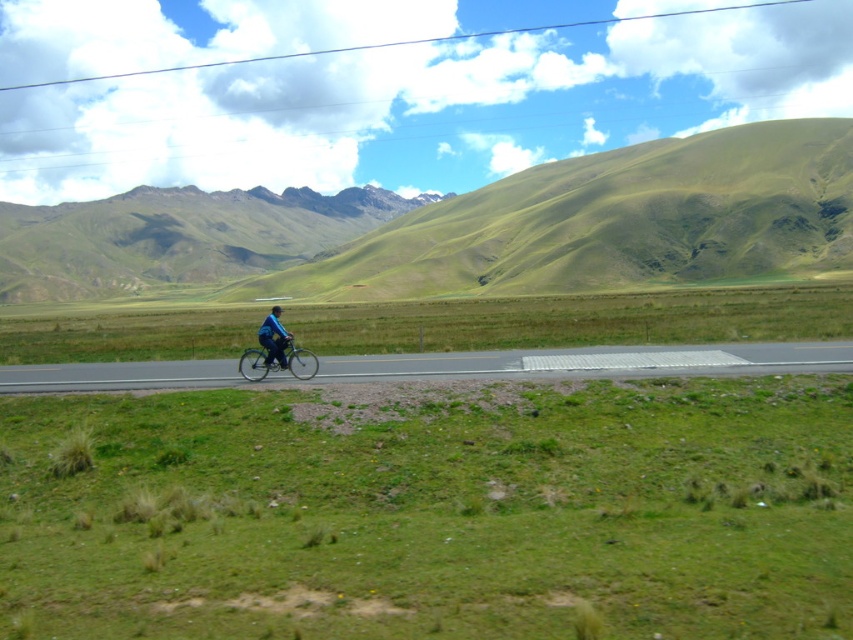
Question: Which object is closer to the camera taking this photo?

Choices:
 (A) black matte helmet at center
 (B) green grassy hill at upper center
 (C) blue matte bicycle at center

Answer: (C)

Question: Which object is positioned closest to the green grassy mountain at upper center?

Choices:
 (A) blue matte bicycle at center
 (B) black matte helmet at center
 (C) blue fabric jacket at center

Answer: (B)

Question: Which of these objects is positioned closest to the blue fabric jacket at center?

Choices:
 (A) blue matte bicycle at center
 (B) green grassy hill at upper center
 (C) black matte helmet at center

Answer: (A)

Question: Does green grassy mountain at upper center have a lesser width compared to blue fabric jacket at center?

Choices:
 (A) no
 (B) yes

Answer: (A)

Question: Observing the image, what is the correct spatial positioning of green grassy mountain at upper center in reference to blue matte bicycle at center?

Choices:
 (A) right
 (B) left

Answer: (B)

Question: Can you confirm if green grassy hill at upper center is positioned above green grassy mountain at upper center?

Choices:
 (A) no
 (B) yes

Answer: (A)